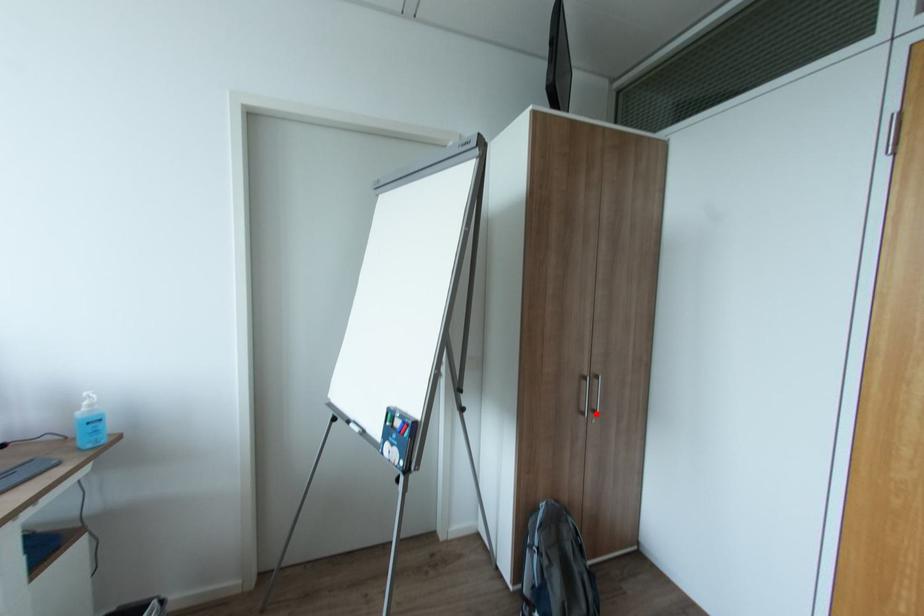
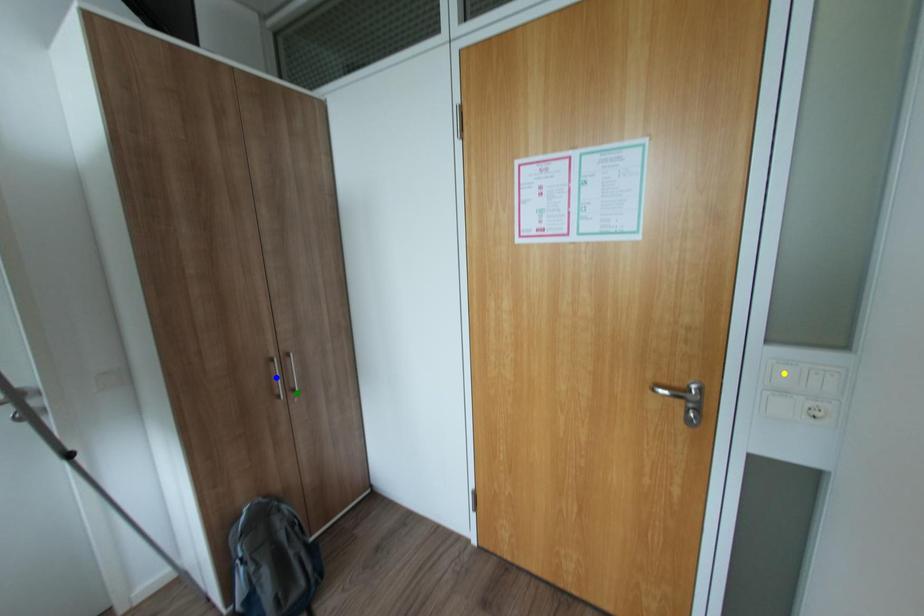
Question: I am providing you with two images of the same scene from different viewpoints. A red point is marked on the first image. You are given multiple points on the second image. Which point in image 2 represents the same 3d spot as the red point in image 1?

Choices:
 (A) blue point
 (B) green point
 (C) yellow point

Answer: (B)